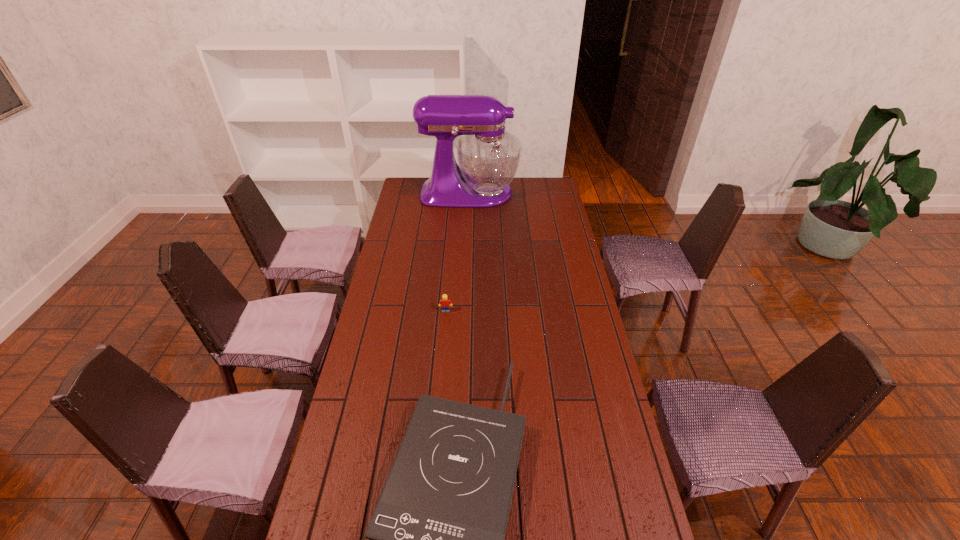
Where is `the tallest object`? The width and height of the screenshot is (960, 540). the tallest object is located at coordinates (488, 157).

Where is `mixer`? This screenshot has height=540, width=960. mixer is located at coordinates (488, 157).

Where is `the second nearest object`? The width and height of the screenshot is (960, 540). the second nearest object is located at coordinates 444,302.

Where is `Lego`? Lego is located at coordinates (444, 302).

At what (x,y) coordinates should I click in order to perform the action: click on vacant space located 0.100m at the bowl opening of the farthest object. Please return your answer as a coordinate pair (x, y). The image size is (960, 540). Looking at the image, I should click on (538, 193).

Locate an element on the screen. Image resolution: width=960 pixels, height=540 pixels. free location located 0.340m on the front-facing side of the second nearest object is located at coordinates (440, 388).

Where is `object that is at the far edge`? object that is at the far edge is located at coordinates (488, 157).

Image resolution: width=960 pixels, height=540 pixels. I want to click on object positioned at the left edge, so click(488, 157).

The width and height of the screenshot is (960, 540). I want to click on object at the far left corner, so click(488, 157).

Find the location of a particular element. Image resolution: width=960 pixels, height=540 pixels. vacant position at the left edge of the desktop is located at coordinates click(x=413, y=310).